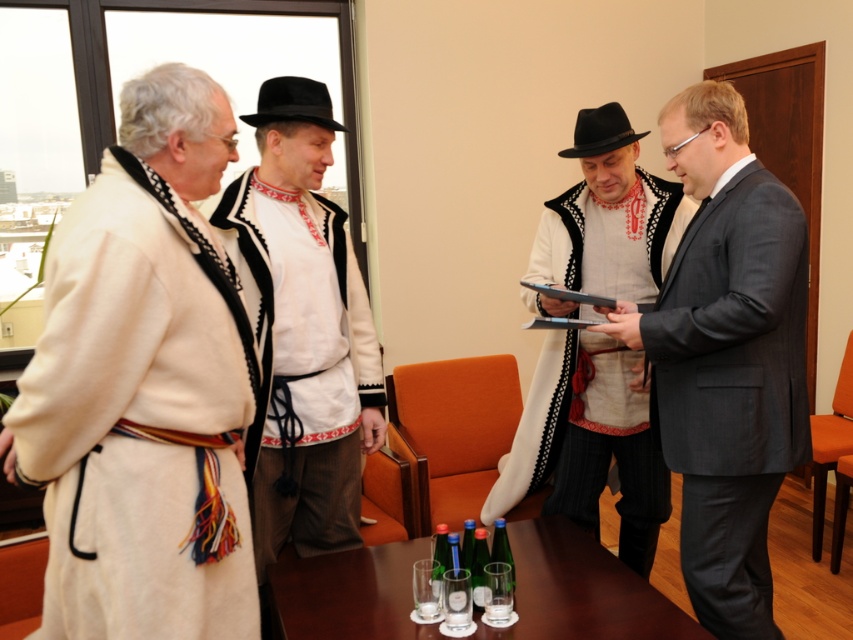
You are a photographer setting up for a cultural event. You need to ensure that all attire details are visible in the photo. Given the white embroidered shirt at center and the matte black vest at center, which one might require a different lighting setup to ensure visibility?

The matte black vest at center might require a different lighting setup because it is taller than the white embroidered shirt at center, so proper lighting can help highlight its details without overshadowing the embroidery on the shirt.